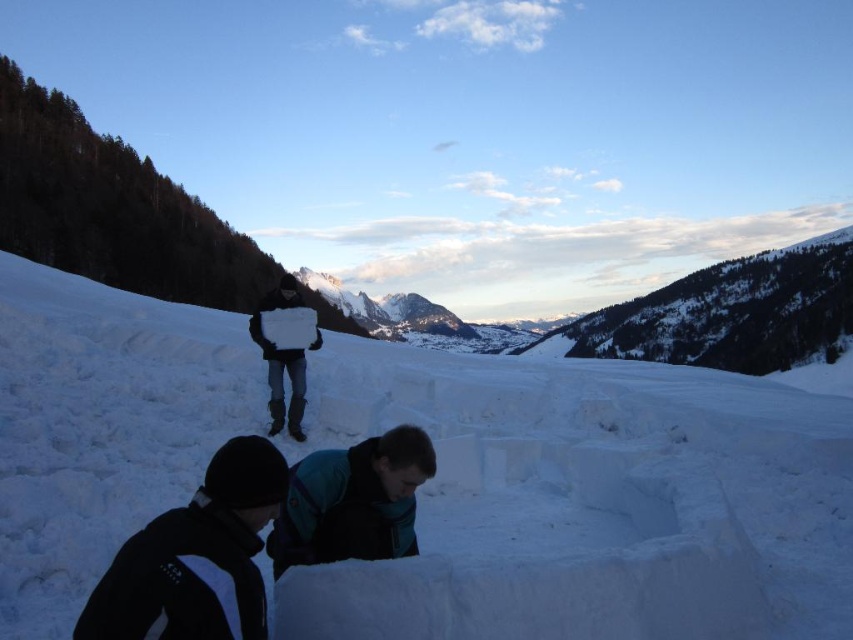
You are trying to place a snow block from the white frosty snow at center onto the structure. Considering the size of the snow block and the space available, can you determine if the snow block will fit in the area where the black soft jacket at lower center is located?

The white frosty snow at center might be wider than black soft jacket at lower center, so the snow block from the white frosty snow at center may not fit in the area where the black soft jacket at lower center is located due to its potentially larger width.

You are standing in the snowy landscape and see the white frosty snow at center and the black soft jacket at lower center. Which object is located higher up in the image?

The white frosty snow at center is positioned over the black soft jacket at lower center, so it is higher up in the image.